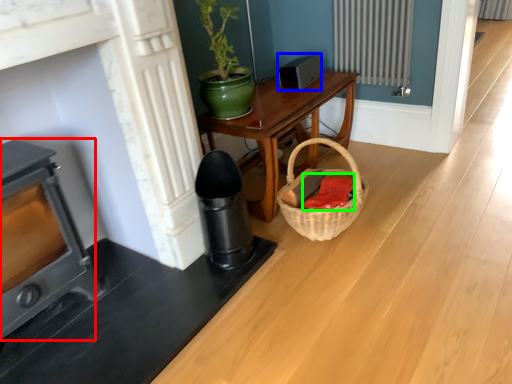
Question: Which object is positioned closest to heater (highlighted by a red box)? Select from appliance (highlighted by a blue box) and material (highlighted by a green box).

Choices:
 (A) appliance
 (B) material

Answer: (B)